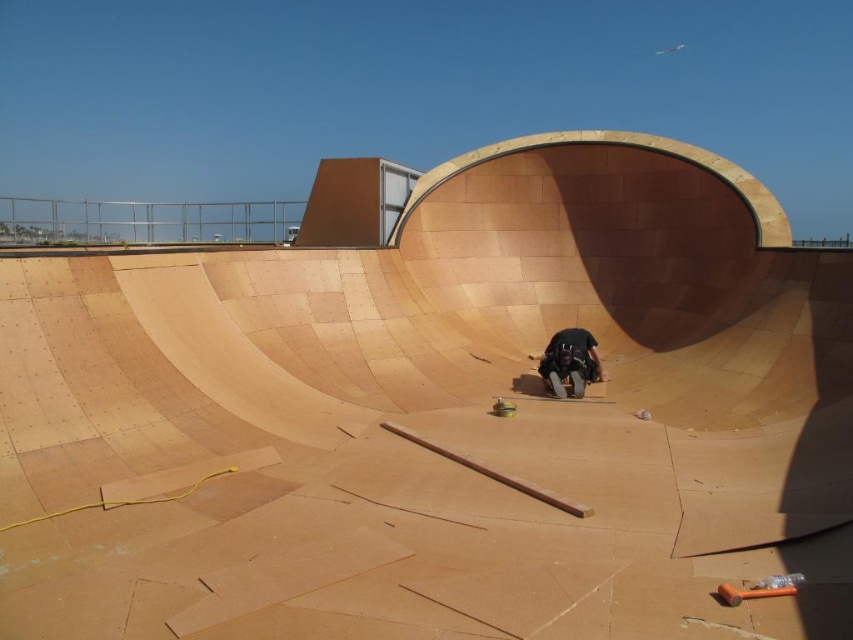
Which is behind, point (563, 332) or point (572, 396)?

The point (563, 332) is more distant.

Can you confirm if black matte skateboarder at center is positioned below smooth brown skateboard at center?

No.

This screenshot has height=640, width=853. Identify the location of black matte skateboarder at center. (570, 362).